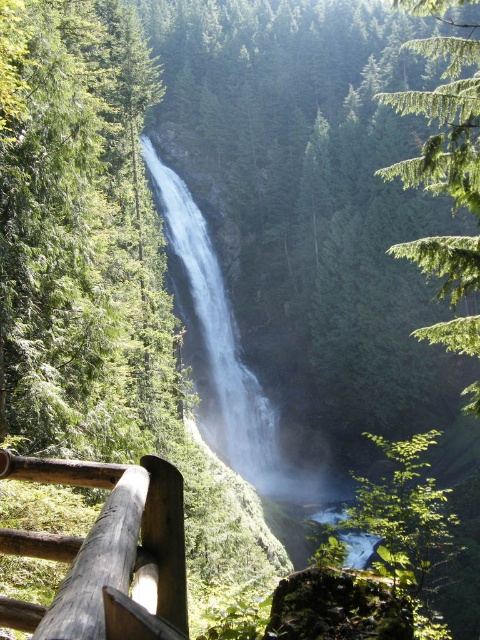
Looking at this image, between dark brown wooden rail at lower left and green textured tree at upper right, which one is positioned higher?

green textured tree at upper right is above.

You are a GUI agent. You are given a task and a screenshot of the screen. Output one action in this format:
    pyautogui.click(x=<x>, y=<y>)
    Task: Click on the dark brown wooden rail at lower left
    The image size is (480, 640).
    Given the screenshot: What is the action you would take?
    pyautogui.click(x=108, y=554)

Is point (78, 554) positioned after point (432, 332)?

No.

This screenshot has width=480, height=640. In order to click on dark brown wooden rail at lower left in this screenshot , I will do `click(108, 554)`.

Is point (19, 456) positioned after point (170, 218)?

No, it is not.

Between dark brown wooden rail at lower left and white smooth waterfall at center, which one is positioned higher?

Positioned higher is white smooth waterfall at center.

What do you see at coordinates (108, 554) in the screenshot? This screenshot has width=480, height=640. I see `dark brown wooden rail at lower left` at bounding box center [108, 554].

The height and width of the screenshot is (640, 480). I want to click on dark brown wooden rail at lower left, so click(x=108, y=554).

Which is more to the right, green textured tree at upper right or white smooth waterfall at center?

green textured tree at upper right is more to the right.

Does green textured tree at upper right appear on the left side of white smooth waterfall at center?

Incorrect, green textured tree at upper right is not on the left side of white smooth waterfall at center.

Image resolution: width=480 pixels, height=640 pixels. I want to click on green textured tree at upper right, so click(444, 112).